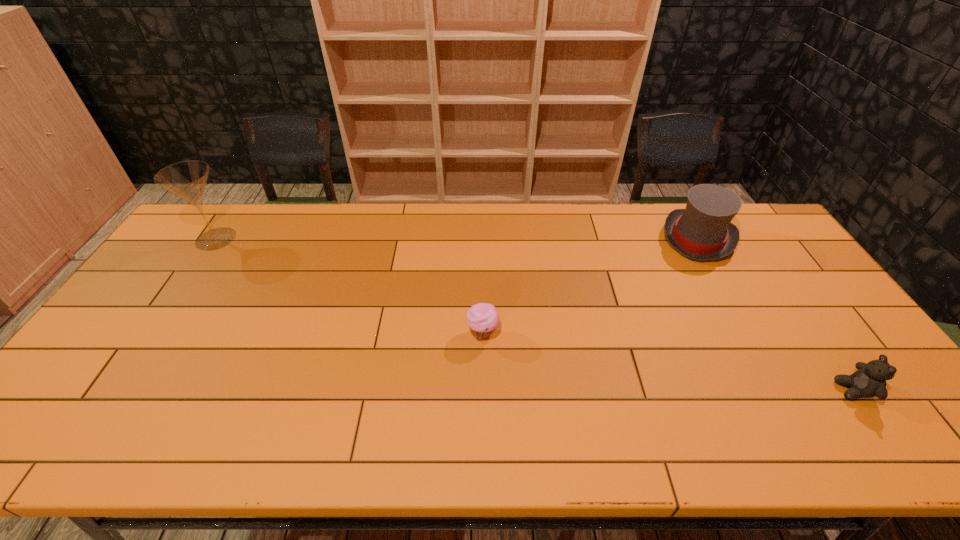
Locate an element on the screen. This screenshot has width=960, height=540. the leftmost object is located at coordinates (187, 179).

Locate an element on the screen. The width and height of the screenshot is (960, 540). the tallest object is located at coordinates click(x=187, y=179).

Where is `the third object from left to right`? The width and height of the screenshot is (960, 540). the third object from left to right is located at coordinates (703, 231).

The width and height of the screenshot is (960, 540). Identify the location of the third shortest object. (703, 231).

Identify the location of the second shortest object. click(869, 380).

The height and width of the screenshot is (540, 960). In order to click on the nearest object in this screenshot , I will do `click(869, 380)`.

Find the location of `the third farthest object`. the third farthest object is located at coordinates (483, 318).

Identify the location of the third object from right to left. The image size is (960, 540). (483, 318).

You are a GUI agent. You are given a task and a screenshot of the screen. Output one action in this format:
    pyautogui.click(x=<x>, y=<y>)
    Task: Click on the free region located on the right of the leftmost object
    This screenshot has width=960, height=540.
    Given the screenshot: What is the action you would take?
    pyautogui.click(x=265, y=239)

Where is `vacant space located on the left of the third shortest object`? vacant space located on the left of the third shortest object is located at coordinates (553, 238).